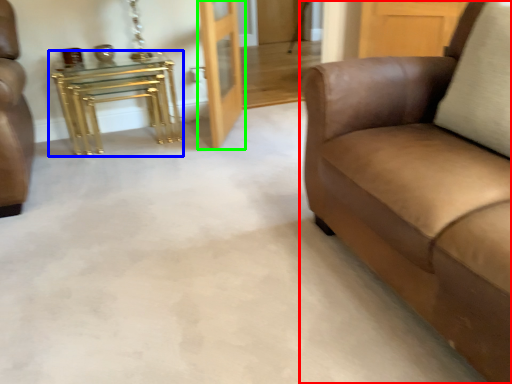
Question: Considering the real-world distances, which object is closest to studio couch (highlighted by a red box)? table (highlighted by a blue box) or door (highlighted by a green box).

Choices:
 (A) table
 (B) door

Answer: (B)